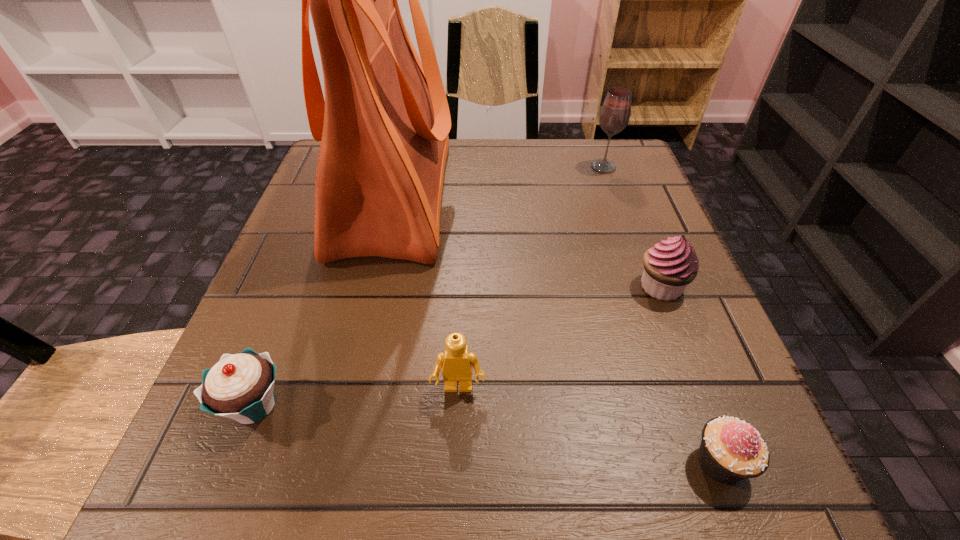
Where is `shopping bag present at the far edge`? shopping bag present at the far edge is located at coordinates (384, 125).

Identify the location of glass drink container located at the far edge. (614, 116).

Find the location of a particular element. The height and width of the screenshot is (540, 960). shopping bag at the left edge is located at coordinates (384, 125).

Image resolution: width=960 pixels, height=540 pixels. What are the coordinates of `cupcake that is at the left edge` in the screenshot? It's located at (241, 386).

At what (x,y) coordinates should I click in order to perform the action: click on glass drink container at the right edge. Please return your answer as a coordinate pair (x, y). The height and width of the screenshot is (540, 960). Looking at the image, I should click on (614, 116).

This screenshot has height=540, width=960. In order to click on object that is at the far left corner in this screenshot , I will do (x=384, y=125).

The height and width of the screenshot is (540, 960). What are the coordinates of `object that is at the near left corner` in the screenshot? It's located at (241, 386).

I want to click on object that is at the far right corner, so click(614, 116).

Find the location of `object that is positioned at the near right corner`. object that is positioned at the near right corner is located at coordinates (731, 450).

In order to click on free region at the far edge of the desktop in this screenshot , I will do `click(474, 183)`.